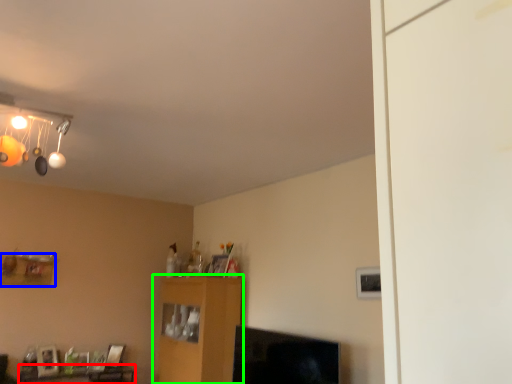
Question: Considering the real-world distances, which object is farthest from table (highlighted by a red box)? shelf (highlighted by a blue box) or furniture (highlighted by a green box)?

Choices:
 (A) shelf
 (B) furniture

Answer: (B)